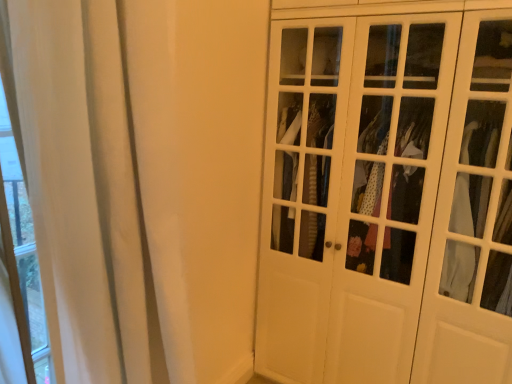
I want to click on white glossy wardrobe at right, so click(388, 195).

What do you see at coordinates (388, 195) in the screenshot? Image resolution: width=512 pixels, height=384 pixels. I see `white glossy wardrobe at right` at bounding box center [388, 195].

I want to click on white glossy wardrobe at right, so click(x=388, y=195).